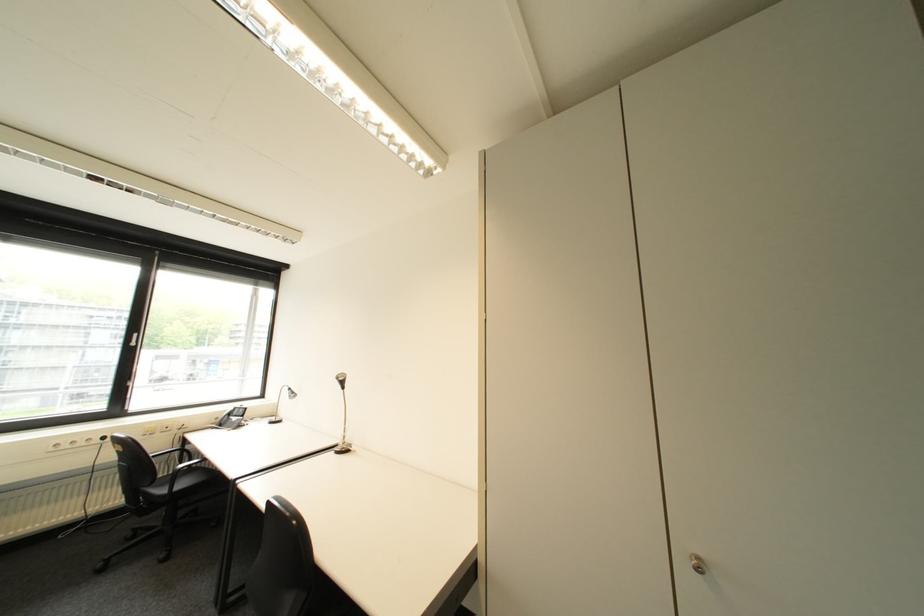
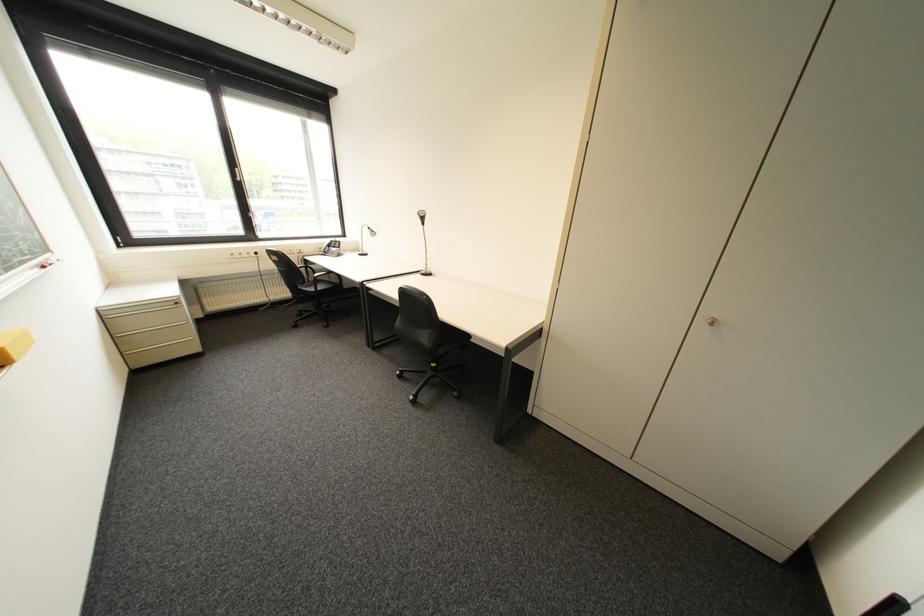
Where in the second image is the point corresponding to (x=143, y=344) from the first image?

(249, 180)